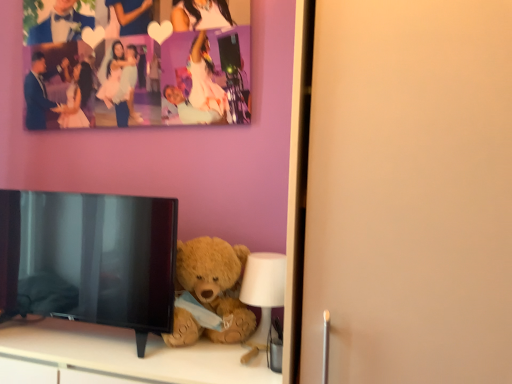
Question: Is soft beige teddy bear at lower center located outside black glossy tv at lower left?

Choices:
 (A) yes
 (B) no

Answer: (A)

Question: Is soft beige teddy bear at lower center shorter than black glossy tv at lower left?

Choices:
 (A) no
 (B) yes

Answer: (B)

Question: Is soft beige teddy bear at lower center looking in the opposite direction of black glossy tv at lower left?

Choices:
 (A) yes
 (B) no

Answer: (B)

Question: Can you confirm if soft beige teddy bear at lower center is wider than black glossy tv at lower left?

Choices:
 (A) yes
 (B) no

Answer: (A)

Question: Considering the relative positions of soft beige teddy bear at lower center and black glossy tv at lower left in the image provided, is soft beige teddy bear at lower center behind black glossy tv at lower left?

Choices:
 (A) yes
 (B) no

Answer: (B)

Question: Considering the relative positions of soft beige teddy bear at lower center and black glossy tv at lower left in the image provided, is soft beige teddy bear at lower center to the right of black glossy tv at lower left from the viewer's perspective?

Choices:
 (A) yes
 (B) no

Answer: (A)

Question: From the image's perspective, does white plastic lamp at lower center appear higher than fuzzy brown teddy bear at lower center?

Choices:
 (A) no
 (B) yes

Answer: (A)

Question: Considering the relative sizes of white plastic lamp at lower center and fuzzy brown teddy bear at lower center in the image provided, is white plastic lamp at lower center smaller than fuzzy brown teddy bear at lower center?

Choices:
 (A) no
 (B) yes

Answer: (B)

Question: Does white plastic lamp at lower center have a larger size compared to fuzzy brown teddy bear at lower center?

Choices:
 (A) yes
 (B) no

Answer: (B)

Question: Is white plastic lamp at lower center positioned behind fuzzy brown teddy bear at lower center?

Choices:
 (A) no
 (B) yes

Answer: (B)

Question: Can you confirm if white plastic lamp at lower center is positioned to the right of fuzzy brown teddy bear at lower center?

Choices:
 (A) no
 (B) yes

Answer: (B)

Question: Is white plastic lamp at lower center thinner than fuzzy brown teddy bear at lower center?

Choices:
 (A) no
 (B) yes

Answer: (B)

Question: Is white plastic lamp at lower center taller than soft beige teddy bear at lower center?

Choices:
 (A) yes
 (B) no

Answer: (B)